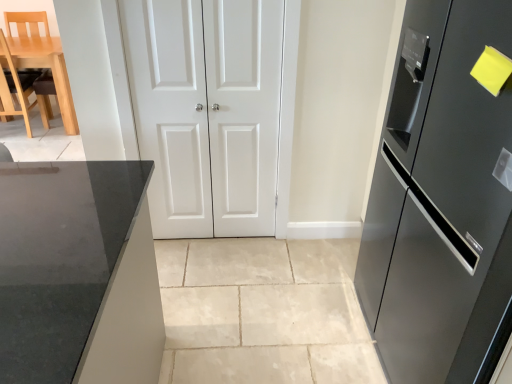
The height and width of the screenshot is (384, 512). What do you see at coordinates (441, 198) in the screenshot?
I see `satin black refrigerator at right` at bounding box center [441, 198].

Locate an element on the screen. light wood/leather chair at left is located at coordinates (18, 90).

Who is taller, white matte door at center, which is the second door in left-to-right order, or white glossy door at center, which is counted as the first door, starting from the left?

With more height is white glossy door at center, which is counted as the first door, starting from the left.

From a real-world perspective, is white matte door at center, which is the second door in left-to-right order, on top of white glossy door at center, which is counted as the first door, starting from the left?

Correct, in the physical world, white matte door at center, which is the second door in left-to-right order, is higher than white glossy door at center, which is counted as the first door, starting from the left.

Can you confirm if white matte door at center, which is the second door in left-to-right order, is positioned to the left of white glossy door at center, which is counted as the 2th door, starting from the right?

In fact, white matte door at center, which is the second door in left-to-right order, is to the right of white glossy door at center, which is counted as the 2th door, starting from the right.

Between point (234, 221) and point (272, 164), which one is positioned in front?

The point (272, 164) is in front.

Does white glossy door at center, which is counted as the 2th door, starting from the right, have a lesser width compared to white matte door at center, the 1th door in the right-to-left sequence?

No, white glossy door at center, which is counted as the 2th door, starting from the right, is not thinner than white matte door at center, the 1th door in the right-to-left sequence.

Who is taller, white glossy door at center, which is counted as the 2th door, starting from the right, or white matte door at center, the 1th door in the right-to-left sequence?

white glossy door at center, which is counted as the 2th door, starting from the right.

In terms of size, does white glossy door at center, which is counted as the 2th door, starting from the right, appear bigger or smaller than white matte door at center, which is the second door in left-to-right order?

white glossy door at center, which is counted as the 2th door, starting from the right, is bigger than white matte door at center, which is the second door in left-to-right order.

In the scene shown: Considering the positions of objects white glossy door at center, which is counted as the 2th door, starting from the right, and white matte door at center, the 1th door in the right-to-left sequence, in the image provided, who is more to the right, white glossy door at center, which is counted as the 2th door, starting from the right, or white matte door at center, the 1th door in the right-to-left sequence,?

From the viewer's perspective, white matte door at center, the 1th door in the right-to-left sequence, appears more on the right side.

From a real-world perspective, is satin black refrigerator at right located higher than light wood/leather chair at left?

Yes, from a real-world perspective, satin black refrigerator at right is above light wood/leather chair at left.

Is satin black refrigerator at right positioned beyond the bounds of light wood/leather chair at left?

Yes, satin black refrigerator at right is not within light wood/leather chair at left.

From the image's perspective, between satin black refrigerator at right and light wood/leather chair at left, who is located below?

satin black refrigerator at right, from the image's perspective.

Can we say light wood/leather chair at left lies outside satin black refrigerator at right?

Yes, light wood/leather chair at left is outside of satin black refrigerator at right.

Considering the positions of objects light wood/leather chair at left and satin black refrigerator at right in the image provided, who is in front, light wood/leather chair at left or satin black refrigerator at right?

satin black refrigerator at right is closer to the camera.

How much distance is there between light wood/leather chair at left and satin black refrigerator at right?

light wood/leather chair at left is 4.02 meters away from satin black refrigerator at right.

From the image's perspective, between light wood/leather chair at left and satin black refrigerator at right, which one is located above?

From the image's view, light wood/leather chair at left is above.

Between light wood/leather chair at left and white matte door at center, which is the second door in left-to-right order, which one appears on the left side from the viewer's perspective?

From the viewer's perspective, light wood/leather chair at left appears more on the left side.

Does light wood/leather chair at left turn towards white matte door at center, which is the second door in left-to-right order?

No, light wood/leather chair at left is not oriented towards white matte door at center, which is the second door in left-to-right order.

Is light wood/leather chair at left wider or thinner than white matte door at center, the 1th door in the right-to-left sequence?

Clearly, light wood/leather chair at left has more width compared to white matte door at center, the 1th door in the right-to-left sequence.

Between light wood/leather chair at left and white matte door at center, the 1th door in the right-to-left sequence, which one has larger size?

light wood/leather chair at left.

Between white glossy door at center, which is counted as the first door, starting from the left, and satin black refrigerator at right, which one is positioned in front?

satin black refrigerator at right.

From the image's perspective, is white glossy door at center, which is counted as the 2th door, starting from the right, located above or below satin black refrigerator at right?

white glossy door at center, which is counted as the 2th door, starting from the right, is above satin black refrigerator at right.

Is white glossy door at center, which is counted as the 2th door, starting from the right, not close to satin black refrigerator at right?

That's not correct — white glossy door at center, which is counted as the 2th door, starting from the right, is a little close to satin black refrigerator at right.

Is white glossy door at center, which is counted as the 2th door, starting from the right, bigger than satin black refrigerator at right?

Actually, white glossy door at center, which is counted as the 2th door, starting from the right, might be smaller than satin black refrigerator at right.

Is satin black refrigerator at right aimed at white matte door at center, which is the second door in left-to-right order?

No.

Looking at this image, considering the sizes of objects satin black refrigerator at right and white matte door at center, which is the second door in left-to-right order, in the image provided, who is taller, satin black refrigerator at right or white matte door at center, which is the second door in left-to-right order,?

satin black refrigerator at right.

Based on the photo, does satin black refrigerator at right appear on the left side of white matte door at center, the 1th door in the right-to-left sequence?

Incorrect, satin black refrigerator at right is not on the left side of white matte door at center, the 1th door in the right-to-left sequence.

From the image's perspective, is satin black refrigerator at right beneath white matte door at center, the 1th door in the right-to-left sequence?

Yes.

Identify the location of door below the white matte door at center, the 1th door in the right-to-left sequence (from the image's perspective). click(x=212, y=112).

Find the location of a particular element. Image resolution: width=512 pixels, height=384 pixels. door directly beneath the white matte door at center, the 1th door in the right-to-left sequence (from a real-world perspective) is located at coordinates (212, 112).

Based on their spatial positions, is white glossy door at center, which is counted as the first door, starting from the left, or white matte door at center, the 1th door in the right-to-left sequence, closer to satin black refrigerator at right?

white matte door at center, the 1th door in the right-to-left sequence, is closer to satin black refrigerator at right.

Considering their positions, is light wood/leather chair at left positioned further to white matte door at center, which is the second door in left-to-right order, than satin black refrigerator at right?

light wood/leather chair at left.

From the picture: Based on their spatial positions, is white glossy door at center, which is counted as the 2th door, starting from the right, or satin black refrigerator at right further from light wood/leather chair at left?

Among the two, satin black refrigerator at right is located further to light wood/leather chair at left.

Estimate the real-world distances between objects in this image. Which object is closer to light wood/leather chair at left, white matte door at center, the 1th door in the right-to-left sequence, or white glossy door at center, which is counted as the 2th door, starting from the right?

white glossy door at center, which is counted as the 2th door, starting from the right, is closer to light wood/leather chair at left.

From the image, which object appears to be farther from white matte door at center, which is the second door in left-to-right order, satin black refrigerator at right or light wood/leather chair at left?

light wood/leather chair at left is positioned further to the anchor white matte door at center, which is the second door in left-to-right order.

Estimate the real-world distances between objects in this image. Which object is closer to white matte door at center, the 1th door in the right-to-left sequence, light wood/leather chair at left or white glossy door at center, which is counted as the first door, starting from the left?

The object closer to white matte door at center, the 1th door in the right-to-left sequence, is white glossy door at center, which is counted as the first door, starting from the left.

Which object lies nearer to the anchor point light wood/leather chair at left, satin black refrigerator at right or white matte door at center, which is the second door in left-to-right order?

white matte door at center, which is the second door in left-to-right order, is closer to light wood/leather chair at left.

Based on their spatial positions, is white matte door at center, which is the second door in left-to-right order, or white glossy door at center, which is counted as the 2th door, starting from the right, closer to satin black refrigerator at right?

white matte door at center, which is the second door in left-to-right order.

This screenshot has width=512, height=384. What are the coordinates of `door between light wood/leather chair at left and white matte door at center, which is the second door in left-to-right order` in the screenshot? It's located at (212, 112).

The height and width of the screenshot is (384, 512). I want to click on door between satin black refrigerator at right and white matte door at center, which is the second door in left-to-right order, in the front-back direction, so click(212, 112).